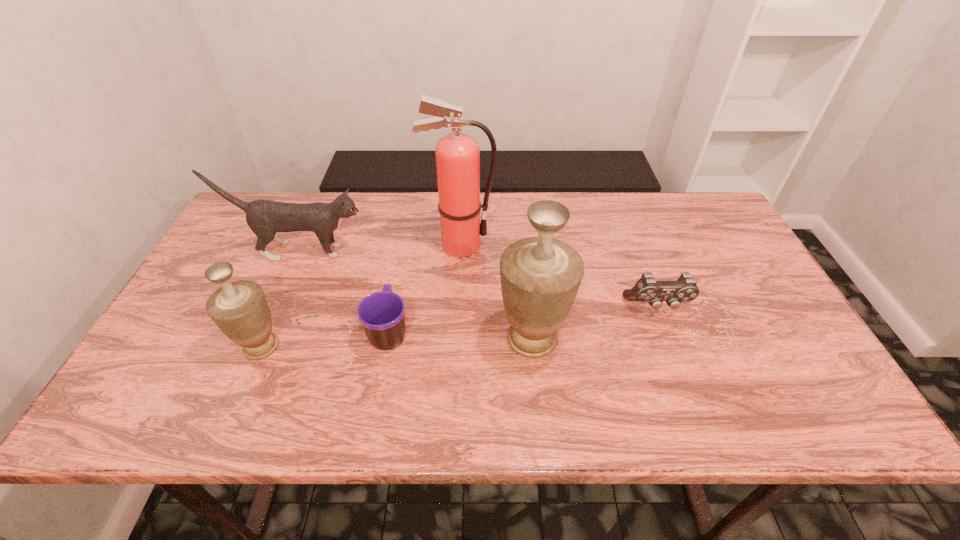
You are a GUI agent. You are given a task and a screenshot of the screen. Output one action in this format:
    pyautogui.click(x=<x>, y=<y>)
    Task: Click on the left urn
    The height and width of the screenshot is (540, 960).
    Given the screenshot: What is the action you would take?
    pyautogui.click(x=240, y=310)

The height and width of the screenshot is (540, 960). Find the location of `the right urn`. the right urn is located at coordinates (540, 276).

Locate an element on the screen. the fifth shortest object is located at coordinates (540, 276).

I want to click on cat, so click(x=265, y=218).

Find the location of `control`. control is located at coordinates (647, 289).

Identify the location of fire extinguisher. This screenshot has width=960, height=540. (457, 154).

Identify the location of the fourth object from right to left. (382, 314).

Where is `free region located 0.070m on the back of the left urn`? Image resolution: width=960 pixels, height=540 pixels. free region located 0.070m on the back of the left urn is located at coordinates click(278, 306).

Identify the location of free region located on the right of the taller urn. (680, 339).

Find the location of a particular element. This screenshot has height=540, width=960. free spot located 0.130m at the face of the cat is located at coordinates (413, 251).